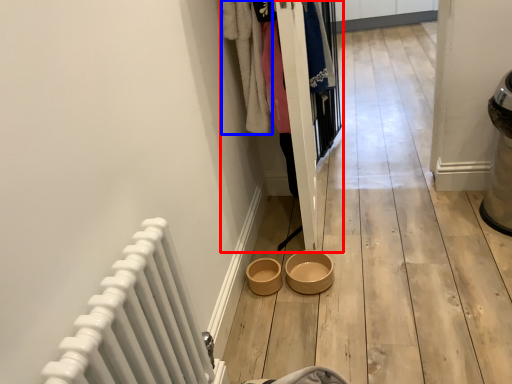
Question: Which object is further to the camera taking this photo, closet (highlighted by a red box) or clothing (highlighted by a blue box)?

Choices:
 (A) closet
 (B) clothing

Answer: (B)